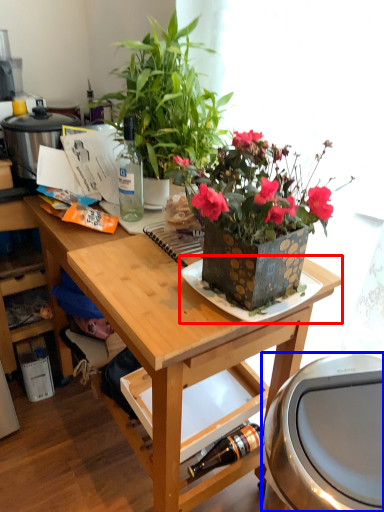
Question: Which point is closer to the camera, plate (highlighted by a red box) or appliance (highlighted by a blue box)?

Choices:
 (A) plate
 (B) appliance

Answer: (B)